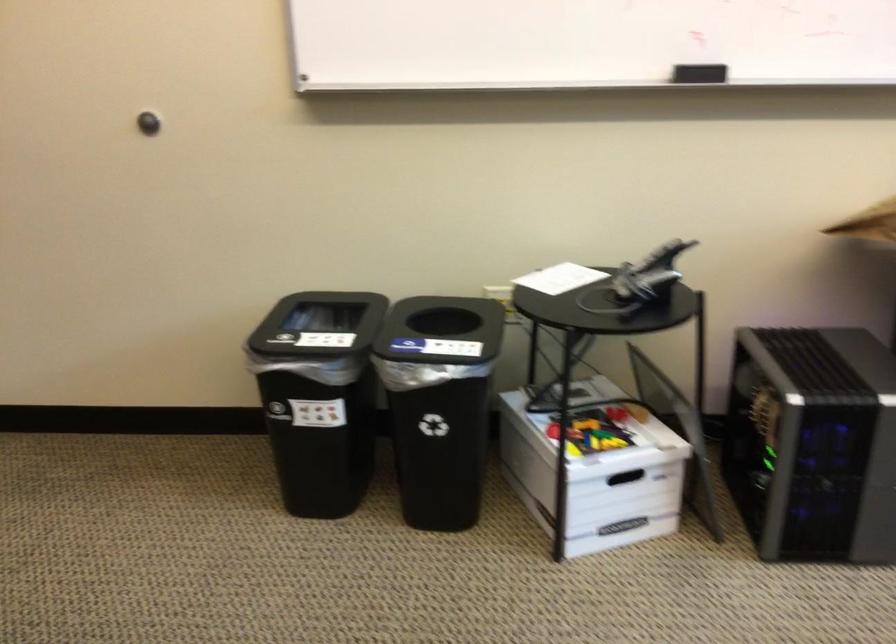
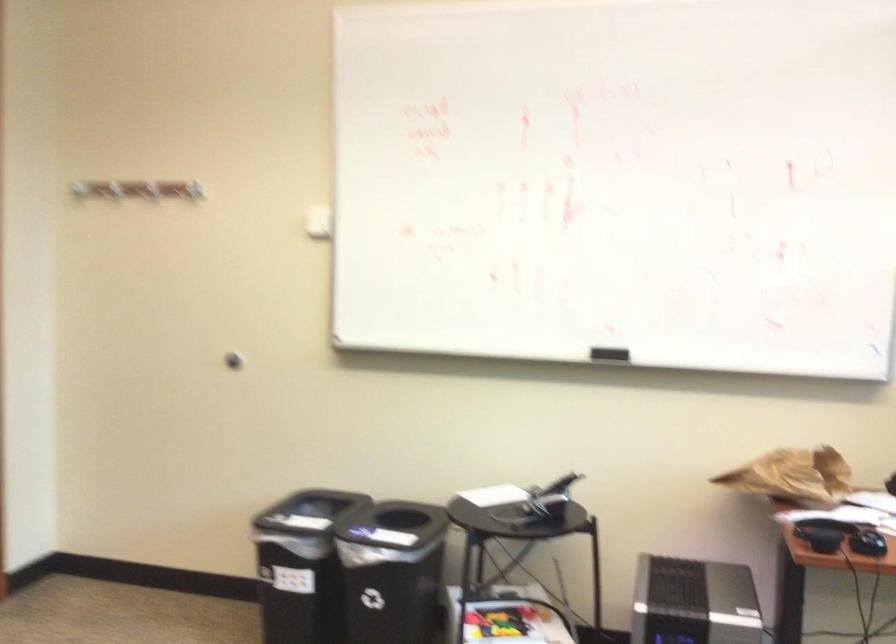
Question: The images are taken continuously from a first-person perspective. In which direction is your viewpoint rotating?

Choices:
 (A) Left
 (B) Right
 (C) Up
 (D) Down

Answer: (C)